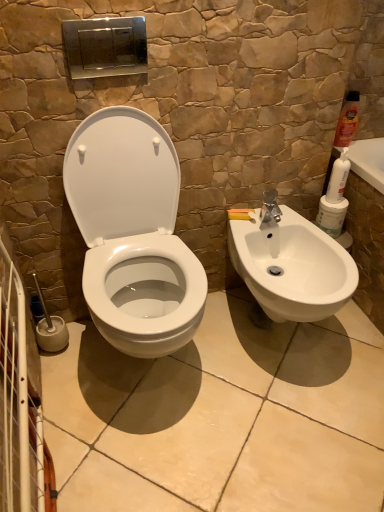
What is the approximate width of white glossy toilet at center?

white glossy toilet at center is 20.73 inches wide.

What is the approximate width of matte orange bottle at upper right, the 1th cleaning product viewed from the right?

It is 2.09 inches.

Find the location of a particular element. The height and width of the screenshot is (512, 384). white glossy toilet at center is located at coordinates (133, 233).

Between point (106, 291) and point (338, 166), which one is positioned behind?

The point (338, 166) is behind.

Which is correct: white glossy toilet at center is inside white matte cleaning product at right, the first cleaning product ordered from the bottom, or outside of it?

white glossy toilet at center is not inside white matte cleaning product at right, the first cleaning product ordered from the bottom, it's outside.

Between white glossy toilet at center and white matte cleaning product at right, the 2th cleaning product viewed from the right, which one has larger size?

white glossy toilet at center.

Locate an element on the screen. The height and width of the screenshot is (512, 384). toilet that is below the white matte cleaning product at right, arranged as the first cleaning product when viewed from the left (from the image's perspective) is located at coordinates click(133, 233).

Considering the sizes of objects matte orange bottle at upper right, the second cleaning product viewed from the left, and white glossy toilet at center in the image provided, who is thinner, matte orange bottle at upper right, the second cleaning product viewed from the left, or white glossy toilet at center?

matte orange bottle at upper right, the second cleaning product viewed from the left, is thinner.

Who is taller, matte orange bottle at upper right, which is the first cleaning product from top to bottom, or white glossy toilet at center?

white glossy toilet at center is taller.

Based on the photo, in the image, is matte orange bottle at upper right, the second cleaning product viewed from the left, positioned in front of or behind white glossy toilet at center?

Visually, matte orange bottle at upper right, the second cleaning product viewed from the left, is located behind white glossy toilet at center.

From a real-world perspective, which is physically above, matte orange bottle at upper right, which is the first cleaning product from top to bottom, or white glossy toilet at center?

matte orange bottle at upper right, which is the first cleaning product from top to bottom, is physically above.

From the image's perspective, who appears lower, white glossy toilet at center or matte orange bottle at upper right, the second cleaning product viewed from the left?

white glossy toilet at center, from the image's perspective.

Considering the positions of points (152, 307) and (346, 126), is point (152, 307) closer to camera compared to point (346, 126)?

Yes, it is.

Based on the photo, can you confirm if white glossy toilet at center is bigger than matte orange bottle at upper right, which is the first cleaning product from top to bottom?

Correct, white glossy toilet at center is larger in size than matte orange bottle at upper right, which is the first cleaning product from top to bottom.

Considering the sizes of objects white matte cleaning product at right, positioned as the 2th cleaning product in top-to-bottom order, and white glossy toilet at center in the image provided, who is thinner, white matte cleaning product at right, positioned as the 2th cleaning product in top-to-bottom order, or white glossy toilet at center?

white matte cleaning product at right, positioned as the 2th cleaning product in top-to-bottom order.

How many degrees apart are the facing directions of white matte cleaning product at right, the 2th cleaning product viewed from the right, and white glossy toilet at center?

The angle between the facing direction of white matte cleaning product at right, the 2th cleaning product viewed from the right, and the facing direction of white glossy toilet at center is 2.67 degrees.

Would you say white matte cleaning product at right, arranged as the first cleaning product when viewed from the left, is to the left or to the right of white glossy toilet at center in the picture?

white matte cleaning product at right, arranged as the first cleaning product when viewed from the left, is positioned on white glossy toilet at center's right side.

From a real-world perspective, which cleaning product is the 1st one above the white glossy toilet at center? Please provide its 2D coordinates.

[(338, 177)]

Considering the sizes of objects matte orange bottle at upper right, which is the first cleaning product from top to bottom, and white matte cleaning product at right, the first cleaning product ordered from the bottom, in the image provided, who is shorter, matte orange bottle at upper right, which is the first cleaning product from top to bottom, or white matte cleaning product at right, the first cleaning product ordered from the bottom,?

Standing shorter between the two is white matte cleaning product at right, the first cleaning product ordered from the bottom.

Is matte orange bottle at upper right, which is the first cleaning product from top to bottom, at the left side of white matte cleaning product at right, positioned as the 2th cleaning product in top-to-bottom order?

No.

Are matte orange bottle at upper right, which is the first cleaning product from top to bottom, and white matte cleaning product at right, the first cleaning product ordered from the bottom, making contact?

No, matte orange bottle at upper right, which is the first cleaning product from top to bottom, is not making contact with white matte cleaning product at right, the first cleaning product ordered from the bottom.

Which object is further away from the camera, matte orange bottle at upper right, the 1th cleaning product viewed from the right, or white matte cleaning product at right, arranged as the first cleaning product when viewed from the left?

matte orange bottle at upper right, the 1th cleaning product viewed from the right, is further from the camera.

Is white matte cleaning product at right, arranged as the first cleaning product when viewed from the left, far from matte orange bottle at upper right, the 2th cleaning product when ordered from bottom to top?

No, white matte cleaning product at right, arranged as the first cleaning product when viewed from the left, is not far away from matte orange bottle at upper right, the 2th cleaning product when ordered from bottom to top.

From a real-world perspective, is white matte cleaning product at right, the first cleaning product ordered from the bottom, on matte orange bottle at upper right, the 2th cleaning product when ordered from bottom to top?

Actually, white matte cleaning product at right, the first cleaning product ordered from the bottom, is physically below matte orange bottle at upper right, the 2th cleaning product when ordered from bottom to top, in the real world.

Is white matte cleaning product at right, arranged as the first cleaning product when viewed from the left, facing away from matte orange bottle at upper right, which is the first cleaning product from top to bottom?

white matte cleaning product at right, arranged as the first cleaning product when viewed from the left, does not have its back to matte orange bottle at upper right, which is the first cleaning product from top to bottom.

Locate an element on the screen. The image size is (384, 512). cleaning product on the right of white matte cleaning product at right, arranged as the first cleaning product when viewed from the left is located at coordinates (347, 120).

From the white glossy toilet at center, count 1st cleaning product to the right and point to it. Please provide its 2D coordinates.

[(338, 177)]

Identify the location of the 2nd cleaning product above the white glossy toilet at center (from a real-world perspective). Image resolution: width=384 pixels, height=512 pixels. (347, 120).

Which object lies nearer to the anchor point white glossy toilet at center, matte orange bottle at upper right, the second cleaning product viewed from the left, or white matte cleaning product at right, the 2th cleaning product viewed from the right?

The object closer to white glossy toilet at center is white matte cleaning product at right, the 2th cleaning product viewed from the right.

When comparing their distances from matte orange bottle at upper right, the 1th cleaning product viewed from the right, does white matte cleaning product at right, the 2th cleaning product viewed from the right, or white glossy toilet at center seem closer?

The object closer to matte orange bottle at upper right, the 1th cleaning product viewed from the right, is white matte cleaning product at right, the 2th cleaning product viewed from the right.

When comparing their distances from white matte cleaning product at right, positioned as the 2th cleaning product in top-to-bottom order, does matte orange bottle at upper right, the 1th cleaning product viewed from the right, or white glossy toilet at center seem closer?

matte orange bottle at upper right, the 1th cleaning product viewed from the right, is positioned closer to the anchor white matte cleaning product at right, positioned as the 2th cleaning product in top-to-bottom order.

Based on their spatial positions, is white glossy toilet at center or matte orange bottle at upper right, the second cleaning product viewed from the left, further from white matte cleaning product at right, the 2th cleaning product viewed from the right?

white glossy toilet at center is further to white matte cleaning product at right, the 2th cleaning product viewed from the right.

From the image, which object appears to be nearer to white glossy toilet at center, white matte cleaning product at right, the first cleaning product ordered from the bottom, or matte orange bottle at upper right, the 1th cleaning product viewed from the right?

white matte cleaning product at right, the first cleaning product ordered from the bottom, lies closer to white glossy toilet at center than the other object.

From the image, which object appears to be nearer to matte orange bottle at upper right, the 1th cleaning product viewed from the right, white glossy toilet at center or white matte cleaning product at right, positioned as the 2th cleaning product in top-to-bottom order?

white matte cleaning product at right, positioned as the 2th cleaning product in top-to-bottom order, lies closer to matte orange bottle at upper right, the 1th cleaning product viewed from the right, than the other object.

Image resolution: width=384 pixels, height=512 pixels. I want to click on cleaning product between white glossy toilet at center and matte orange bottle at upper right, the 2th cleaning product when ordered from bottom to top, from front to back, so click(338, 177).